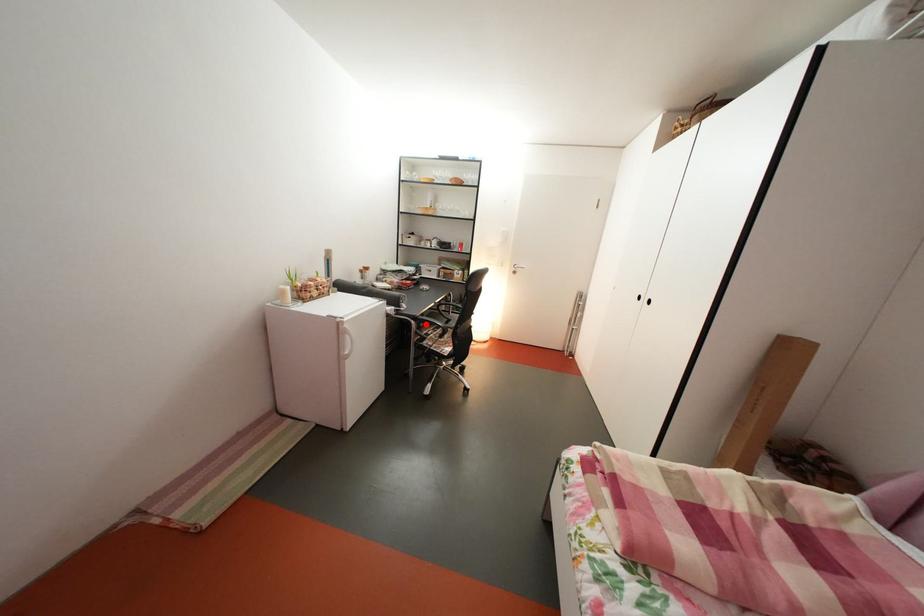
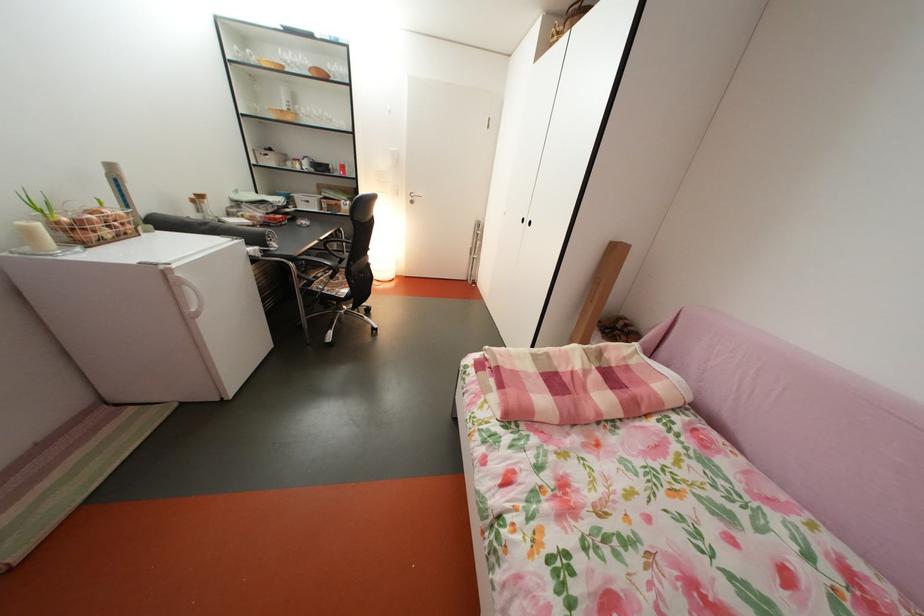
Question: I am providing you with two images of the same scene from different viewpoints. Given a red point in image1, look at the same physical point in image2. Is it:

Choices:
 (A) Closer to the viewpoint
 (B) Farther from the viewpoint

Answer: (A)